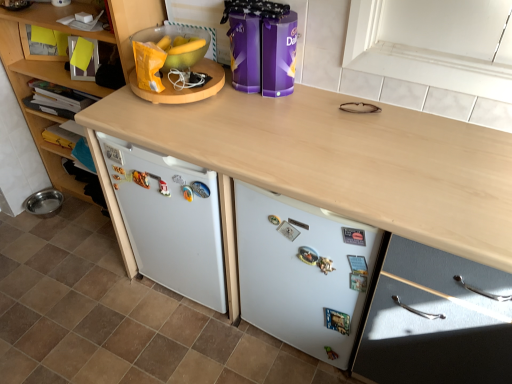
Find the location of a particular element. Image resolution: width=512 pixels, height=384 pixels. vacant area on top of purple glossy chocolate tins at center, positioned as the 1th appliance in right-to-left order (from a real-world perspective) is located at coordinates (262, 19).